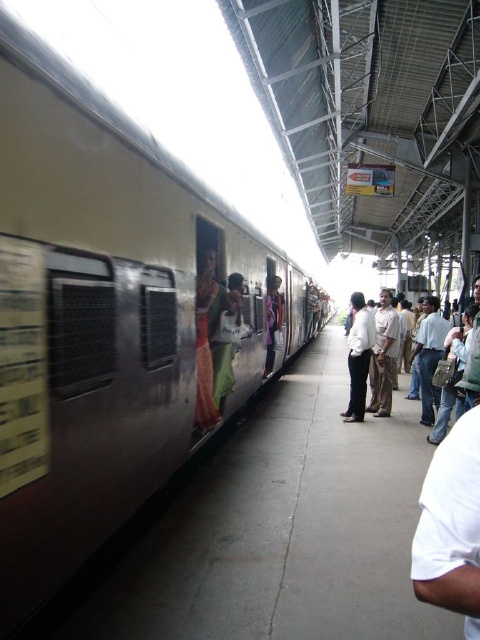
You are a photographer standing on the platform and want to take a photo of the metallic silver train at center and the light brown cotton shirt at center. Which object will appear larger in your photo?

The metallic silver train at center will appear larger in your photo because it is taller than the light brown cotton shirt at center.

You are a delivery robot with a 2 meter wide package. You need to move from the metallic silver train at center to the light brown leather backpack at right. Is there enough space between them for you to pass with your package?

The metallic silver train at center and light brown leather backpack at right are 6.55 meters apart, so yes, the delivery robot can pass with a 2 meter wide package since the distance between them is sufficient.

You are a photographer standing on the platform and want to take a photo of the light brown cotton shirt at center and the light brown leather backpack at right. Which object should you zoom in on to capture both in the frame without moving the camera?

You should zoom in on the light brown cotton shirt at center because it is wider than the light brown leather backpack at right, allowing both to fit in the frame when focusing on the wider object.